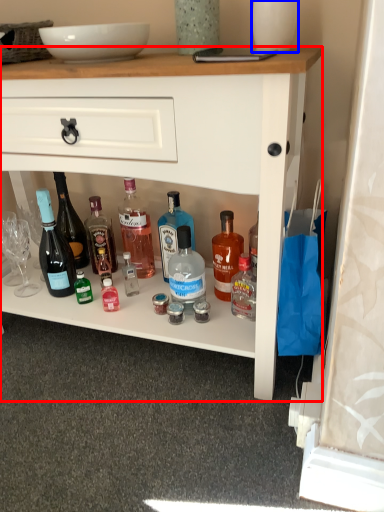
Question: Which object appears farthest to the camera in this image, desk (highlighted by a red box) or glass vase (highlighted by a blue box)?

Choices:
 (A) desk
 (B) glass vase

Answer: (B)